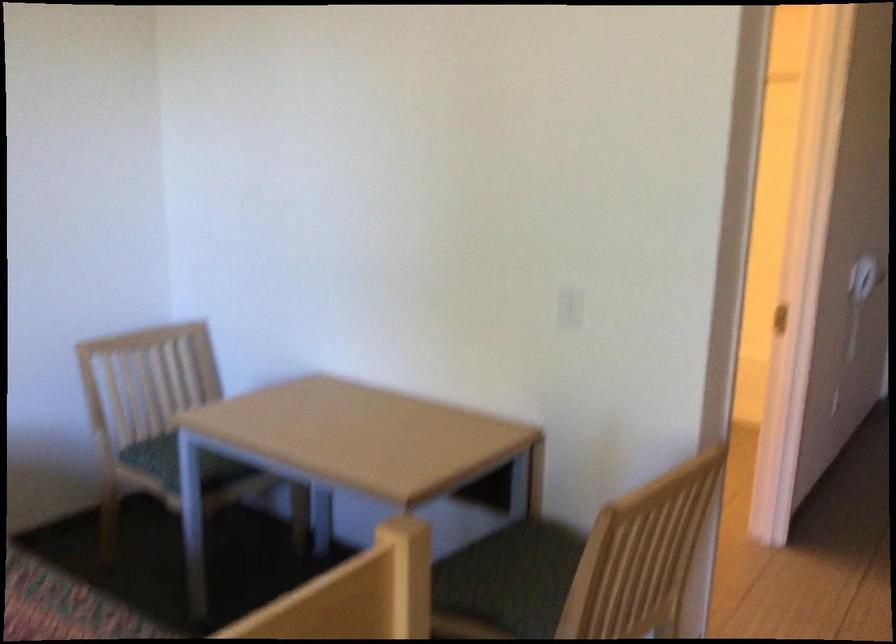
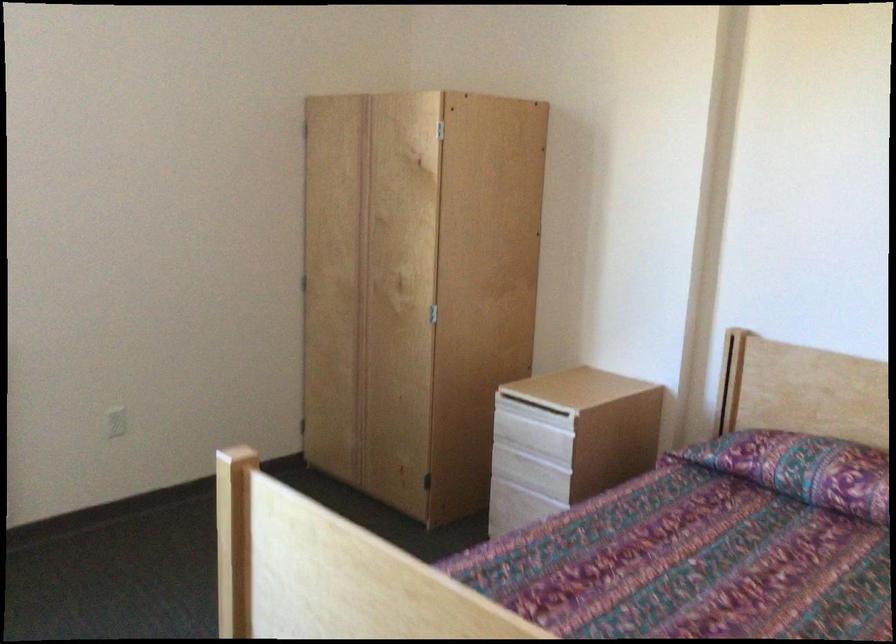
Question: The images are taken continuously from a first-person perspective. In which direction is your viewpoint rotating?

Choices:
 (A) Left
 (B) Right
 (C) Up
 (D) Down

Answer: (A)